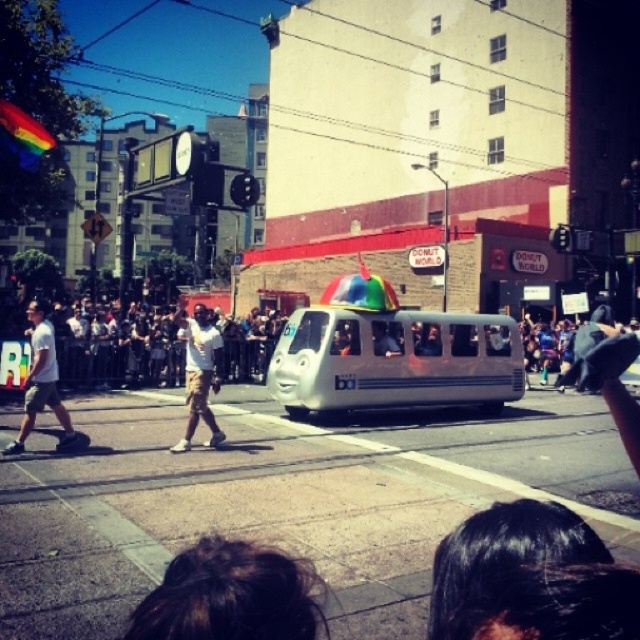
Question: Is white matte bus at center thinner than white cotton shirt at left?

Choices:
 (A) yes
 (B) no

Answer: (B)

Question: Which point appears closest to the camera in this image?

Choices:
 (A) (205, 401)
 (B) (35, 321)
 (C) (474, 344)
 (D) (230, 540)

Answer: (D)

Question: Which point is closer to the camera taking this photo?

Choices:
 (A) [35, 412]
 (B) [566, 516]
 (C) [131, 628]

Answer: (C)

Question: Can you confirm if white cotton shirt at center is positioned above white cotton shirt at left?

Choices:
 (A) no
 (B) yes

Answer: (A)

Question: Among these objects, which one is farthest from the camera?

Choices:
 (A) white matte bus at center
 (B) white cotton shirt at center
 (C) dark brown hair at lower center
 (D) black hair at upper center

Answer: (A)

Question: Can you confirm if white matte bus at center is positioned to the right of white cotton shirt at center?

Choices:
 (A) no
 (B) yes

Answer: (B)